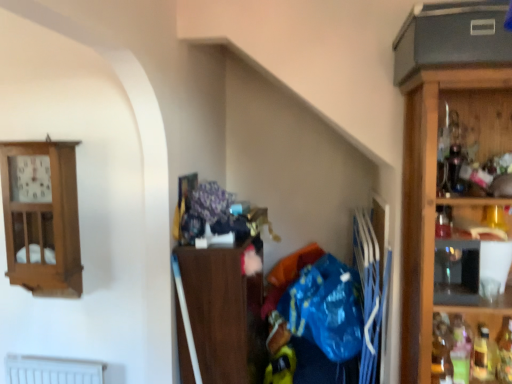
Question: Does blue plastic bag at center lie in front of wooden clock at upper left, the 1th cabinetry from the left?

Choices:
 (A) yes
 (B) no

Answer: (A)

Question: Does blue plastic bag at center appear on the right side of wooden clock at upper left, the 1th cabinetry from the left?

Choices:
 (A) no
 (B) yes

Answer: (B)

Question: Is wooden clock at upper left, acting as the 2th cabinetry starting from the right, at the back of blue plastic bag at center?

Choices:
 (A) yes
 (B) no

Answer: (B)

Question: Is blue plastic bag at center bigger than wooden clock at upper left, the 1th cabinetry from the left?

Choices:
 (A) yes
 (B) no

Answer: (A)

Question: From the image's perspective, would you say blue plastic bag at center is positioned over wooden clock at upper left, the 1th cabinetry from the left?

Choices:
 (A) no
 (B) yes

Answer: (A)

Question: Are blue plastic bag at center and wooden clock at upper left, acting as the 2th cabinetry starting from the right, beside each other?

Choices:
 (A) no
 (B) yes

Answer: (A)

Question: From the image's perspective, does translucent plastic bottle at lower right, the 1th bottle positioned from the right, appear lower than translucent glass bottle at right, the fourth bottle when ordered from right to left?

Choices:
 (A) no
 (B) yes

Answer: (A)

Question: Does translucent plastic bottle at lower right, which is the 4th bottle from left to right, come in front of translucent glass bottle at right, the fourth bottle when ordered from right to left?

Choices:
 (A) yes
 (B) no

Answer: (B)

Question: Does translucent plastic bottle at lower right, which is the 4th bottle from left to right, appear on the right side of translucent glass bottle at right, the first bottle viewed from the left?

Choices:
 (A) no
 (B) yes

Answer: (B)

Question: Does translucent plastic bottle at lower right, which is the 4th bottle from left to right, have a greater width compared to translucent glass bottle at right, the fourth bottle when ordered from right to left?

Choices:
 (A) yes
 (B) no

Answer: (B)

Question: Is translucent plastic bottle at lower right, the 1th bottle positioned from the right, behind translucent glass bottle at right, the fourth bottle when ordered from right to left?

Choices:
 (A) yes
 (B) no

Answer: (A)

Question: Is translucent plastic bottle at lower right, which is the 4th bottle from left to right, thinner than translucent glass bottle at right, the fourth bottle when ordered from right to left?

Choices:
 (A) no
 (B) yes

Answer: (B)

Question: From the image's perspective, is translucent glass bottle at lower right, marked as the third bottle in a right-to-left arrangement, beneath translucent plastic bottle at lower right, which is the 4th bottle from left to right?

Choices:
 (A) no
 (B) yes

Answer: (B)